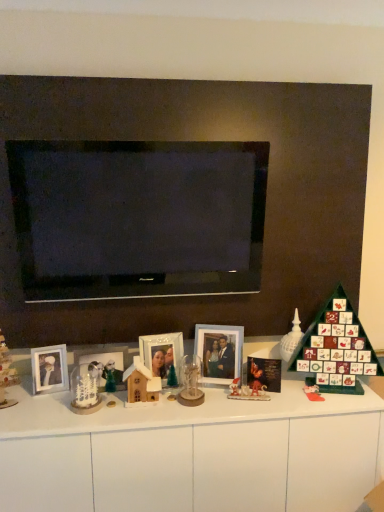
Question: From a real-world perspective, is wooden house at center, which appears as the first toy when viewed from the front, positioned under white glossy dresser at center based on gravity?

Choices:
 (A) no
 (B) yes

Answer: (A)

Question: Is wooden house at center, the third toy viewed from the back, smaller than white glossy dresser at center?

Choices:
 (A) no
 (B) yes

Answer: (B)

Question: Is wooden house at center, the third toy viewed from the right, positioned in front of white glossy dresser at center?

Choices:
 (A) yes
 (B) no

Answer: (B)

Question: From the image's perspective, would you say wooden house at center, the third toy viewed from the right, is shown under white glossy dresser at center?

Choices:
 (A) no
 (B) yes

Answer: (A)

Question: Considering the relative positions of wooden house at center, the third toy viewed from the back, and white glossy dresser at center in the image provided, is wooden house at center, the third toy viewed from the back, to the left of white glossy dresser at center from the viewer's perspective?

Choices:
 (A) no
 (B) yes

Answer: (B)

Question: In terms of height, does white glossy dresser at center look taller or shorter compared to white frosted glass candle holder at lower left, arranged as the 2th candle holder when viewed from the right?

Choices:
 (A) short
 (B) tall

Answer: (B)

Question: Visually, is white glossy dresser at center positioned to the left or to the right of white frosted glass candle holder at lower left, positioned as the first candle holder in left-to-right order?

Choices:
 (A) left
 (B) right

Answer: (B)

Question: Looking at the image, does white glossy dresser at center seem bigger or smaller compared to white frosted glass candle holder at lower left, positioned as the first candle holder in left-to-right order?

Choices:
 (A) small
 (B) big

Answer: (B)

Question: Is point (82, 419) closer or farther from the camera than point (94, 367)?

Choices:
 (A) farther
 (B) closer

Answer: (B)

Question: Looking at the image, does white frosted glass candle holder at lower left, arranged as the 2th candle holder when viewed from the right, seem bigger or smaller compared to clear glass candle holder at center, which is the 1th candle holder in right-to-left order?

Choices:
 (A) big
 (B) small

Answer: (B)

Question: From the image's perspective, is white frosted glass candle holder at lower left, arranged as the 2th candle holder when viewed from the right, positioned above or below clear glass candle holder at center, arranged as the 2th candle holder when viewed from the left?

Choices:
 (A) below
 (B) above

Answer: (A)

Question: Is white frosted glass candle holder at lower left, positioned as the first candle holder in left-to-right order, situated inside clear glass candle holder at center, arranged as the 2th candle holder when viewed from the left, or outside?

Choices:
 (A) outside
 (B) inside

Answer: (A)

Question: From a real-world perspective, is white frosted glass candle holder at lower left, arranged as the 2th candle holder when viewed from the right, above or below clear glass candle holder at center, arranged as the 2th candle holder when viewed from the left?

Choices:
 (A) above
 (B) below

Answer: (B)

Question: From a real-world perspective, is matte plastic toy at right, which is the 3th toy in left-to-right order, positioned above or below clear glass candle holder at center, arranged as the 2th candle holder when viewed from the left?

Choices:
 (A) below
 (B) above

Answer: (A)

Question: Based on their positions, is matte plastic toy at right, arranged as the second toy when viewed from the back, located to the left or right of clear glass candle holder at center, arranged as the 2th candle holder when viewed from the left?

Choices:
 (A) left
 (B) right

Answer: (B)